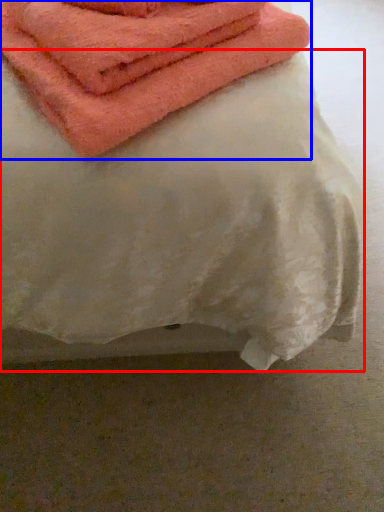
Question: Which point is further to the camera, sheet (highlighted by a red box) or towel (highlighted by a blue box)?

Choices:
 (A) sheet
 (B) towel

Answer: (B)